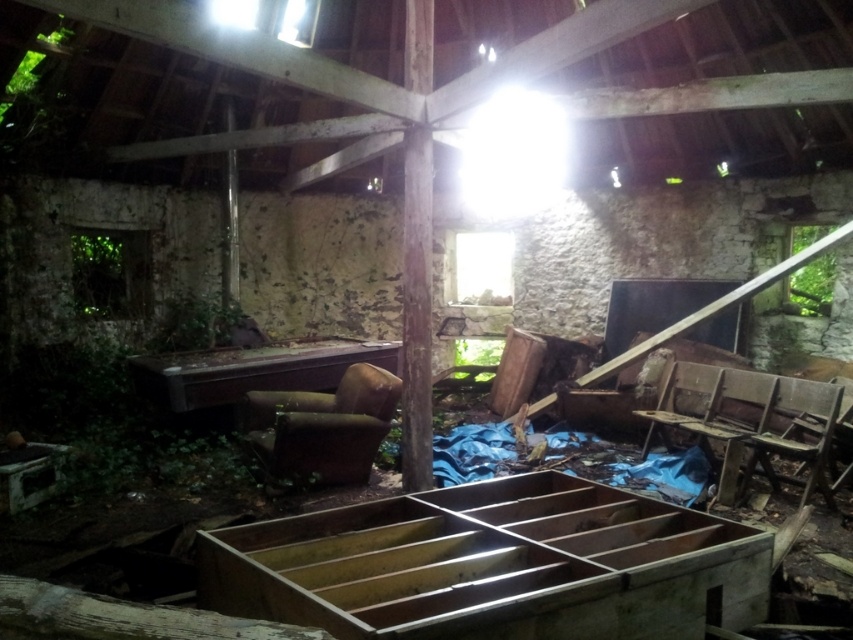
You are an archaeologist exploring the dilapidated building and need to move from the wooden desk at center to the worn wood chair at lower right. Which direction should you move to reach the chair?

The wooden desk at center is positioned on the left side of the worn wood chair at lower right, so you should move to the right to reach the chair.

You are moving furniture into this old building and need to place the brown leather chair at center and the wooden chair at right in a space that can only accommodate items up to 1.2 meters wide. Which chair might not fit?

The brown leather chair at center has a larger width than the wooden chair at right, so it might not fit in the space that can only accommodate items up to 1.2 meters wide.